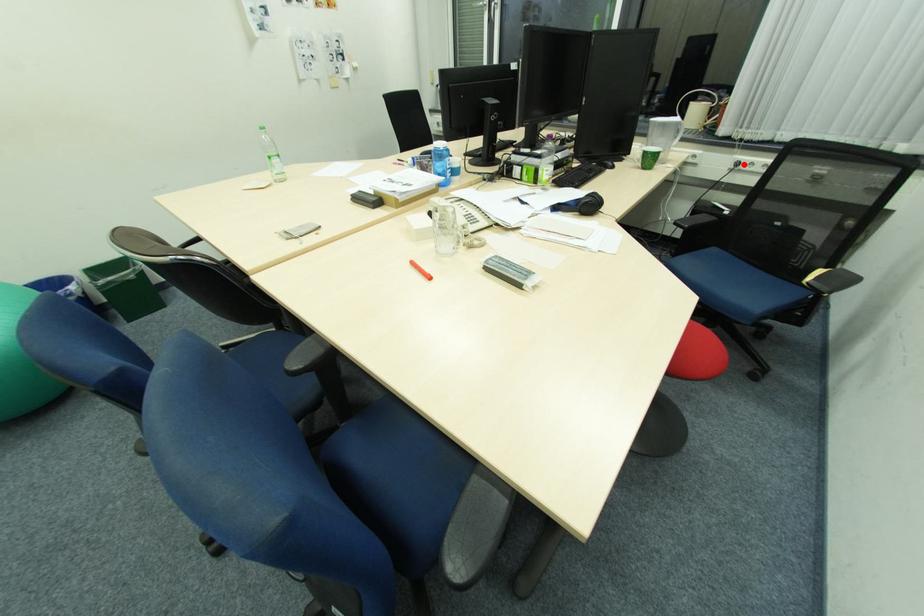
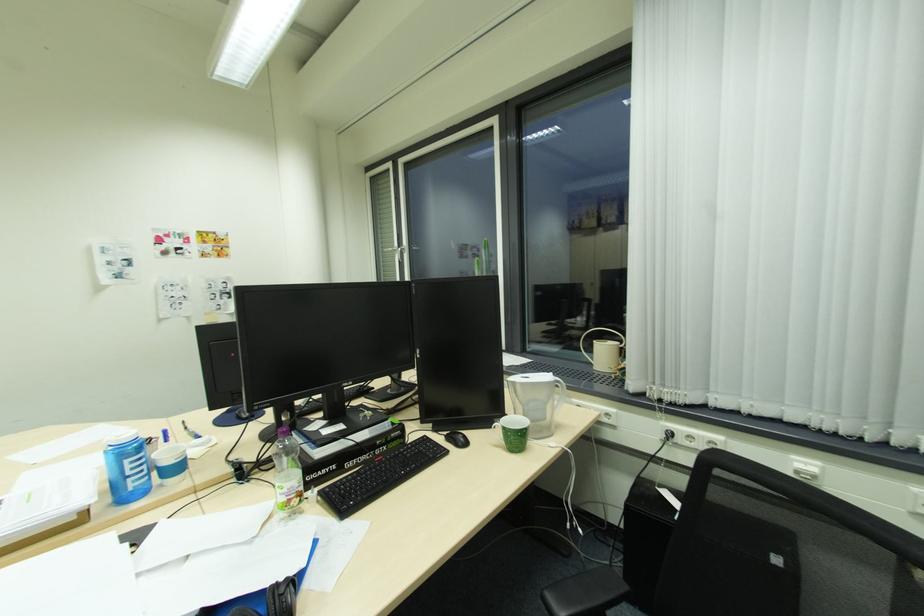
In the second image, find the point that corresponds to the highlighted location in the first image.

(675, 435)